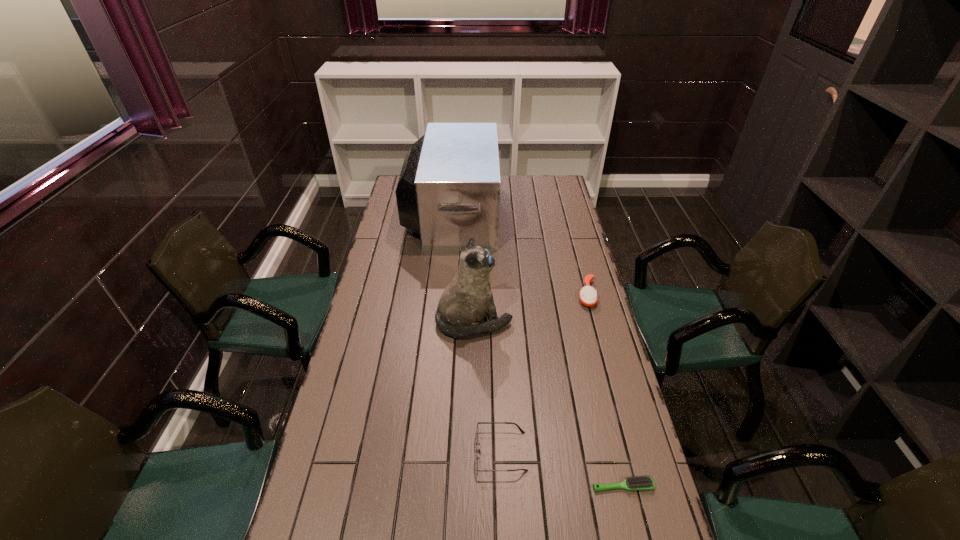
This screenshot has width=960, height=540. Identify the location of vacant space at the far right corner of the desktop. click(562, 184).

Locate an element on the screen. The height and width of the screenshot is (540, 960). free spot between the spectacles and the nearest object is located at coordinates (562, 469).

Identify the location of free space between the third tallest object and the microwave oven. (519, 254).

Identify the location of free space that is in between the farther hairbrush and the second nearest object. (543, 373).

Where is `vacant area that lies between the fourth farthest object and the shortest object`? vacant area that lies between the fourth farthest object and the shortest object is located at coordinates [562, 469].

I want to click on free space between the taller hairbrush and the farthest object, so click(x=519, y=254).

I want to click on free point between the nearer hairbrush and the farthest object, so click(538, 350).

Where is `unoccupied area between the nearest object and the third tallest object`? The image size is (960, 540). unoccupied area between the nearest object and the third tallest object is located at coordinates (605, 390).

Identify which object is located as the second nearest to the spectacles. Please provide its 2D coordinates. Your answer should be formatted as a tuple, i.e. [(x, y)], where the tuple contains the x and y coordinates of a point satisfying the conditions above.

[(467, 299)]

Choose which object is the third nearest neighbor to the nearest object. Please provide its 2D coordinates. Your answer should be formatted as a tuple, i.e. [(x, y)], where the tuple contains the x and y coordinates of a point satisfying the conditions above.

[(588, 297)]